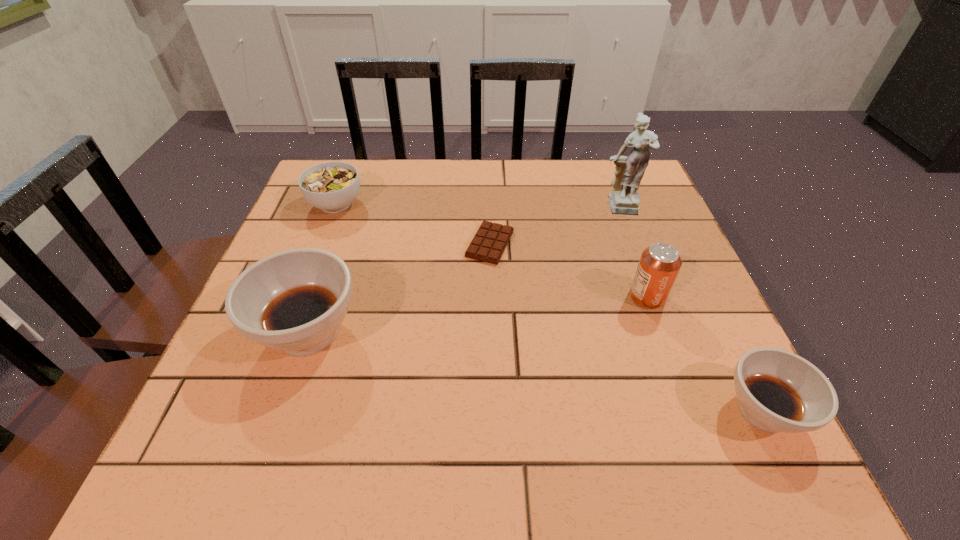
What are the coordinates of `vacant region located 0.150m on the right of the candy bar` in the screenshot? It's located at (579, 244).

Image resolution: width=960 pixels, height=540 pixels. Identify the location of free location located 0.350m on the right of the farthest soup bowl. (498, 204).

Where is `vacant area situated 0.200m on the left of the can`? This screenshot has height=540, width=960. vacant area situated 0.200m on the left of the can is located at coordinates (533, 297).

Locate an element on the screen. The image size is (960, 540). figurine present at the far edge is located at coordinates (624, 199).

Identify the location of soup bowl situated at the far edge. The width and height of the screenshot is (960, 540). (331, 186).

Identify the location of soup bowl that is at the right edge. This screenshot has height=540, width=960. 778,391.

Find the location of `figurine that is at the right edge`. figurine that is at the right edge is located at coordinates (624, 199).

Locate an element on the screen. can located at the right edge is located at coordinates (658, 267).

Find the location of a particular element. The height and width of the screenshot is (540, 960). object that is positioned at the far left corner is located at coordinates (331, 186).

The image size is (960, 540). Identify the location of object situated at the near left corner. (294, 301).